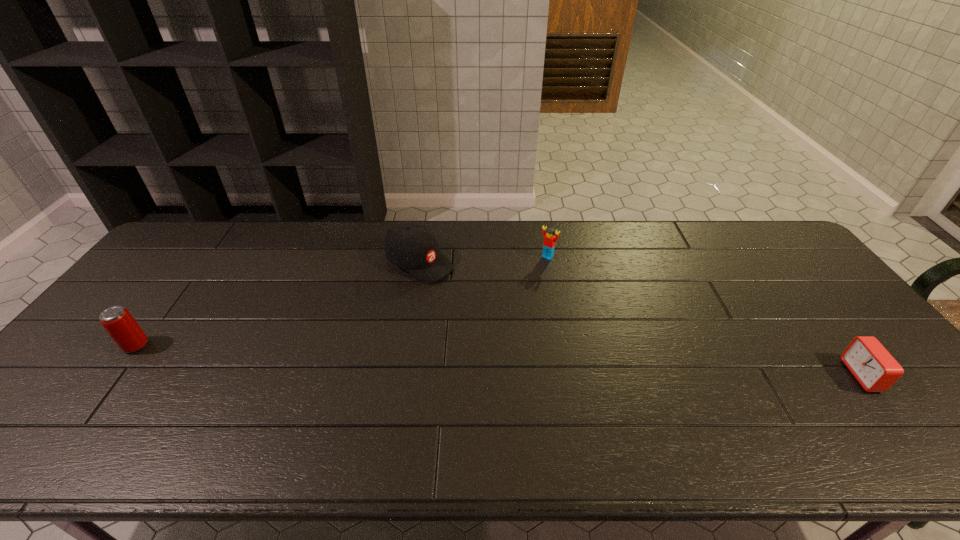
Find the location of a particular element. Image resolution: width=960 pixels, height=540 pixels. free area in between the third farthest object and the nearest object is located at coordinates (499, 361).

At what (x,y) coordinates should I click in order to perform the action: click on free space between the beer can and the third object from left to right. Please return your answer as a coordinate pair (x, y). The image size is (960, 540). Looking at the image, I should click on (342, 301).

The height and width of the screenshot is (540, 960). In order to click on vacant point located between the baseball cap and the Lego in this screenshot , I will do `click(484, 260)`.

Find the location of a particular element. The height and width of the screenshot is (540, 960). unoccupied position between the rightmost object and the Lego is located at coordinates (705, 316).

This screenshot has height=540, width=960. Find the location of `free space between the beer can and the rightmost object`. free space between the beer can and the rightmost object is located at coordinates (499, 361).

Locate which object ranks in proximity to the second object from left to right. Please provide its 2D coordinates. Your answer should be formatted as a tuple, i.e. [(x, y)], where the tuple contains the x and y coordinates of a point satisfying the conditions above.

[(549, 240)]

Identify which object is the second nearest to the leftmost object. Please provide its 2D coordinates. Your answer should be formatted as a tuple, i.e. [(x, y)], where the tuple contains the x and y coordinates of a point satisfying the conditions above.

[(549, 240)]

Locate an element on the screen. free location that satisfies the following two spatial constraints: 1. on the back side of the third object from right to left; 2. on the left side of the third farthest object is located at coordinates (199, 262).